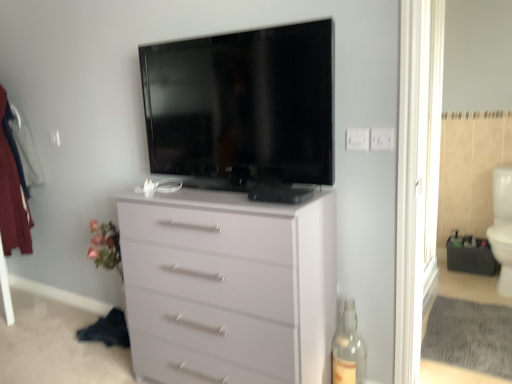
Question: From a real-world perspective, is transparent glass door at right physically below white glossy toilet bowl at right?

Choices:
 (A) yes
 (B) no

Answer: (B)

Question: Can you confirm if transparent glass door at right is wider than white glossy toilet bowl at right?

Choices:
 (A) no
 (B) yes

Answer: (A)

Question: Can you confirm if transparent glass door at right is smaller than white glossy toilet bowl at right?

Choices:
 (A) no
 (B) yes

Answer: (A)

Question: Can you confirm if transparent glass door at right is shorter than white glossy toilet bowl at right?

Choices:
 (A) yes
 (B) no

Answer: (B)

Question: Is transparent glass door at right completely or partially outside of white glossy toilet bowl at right?

Choices:
 (A) no
 (B) yes

Answer: (B)

Question: From a real-world perspective, is transparent glass bottle at lower right above or below white plastic electric outlet at upper right, which ranks as the second electric outlet in right-to-left order?

Choices:
 (A) below
 (B) above

Answer: (A)

Question: Considering the positions of point (343, 316) and point (357, 147), is point (343, 316) closer or farther from the camera than point (357, 147)?

Choices:
 (A) farther
 (B) closer

Answer: (A)

Question: Is transparent glass bottle at lower right taller or shorter than white plastic electric outlet at upper right, which appears as the first electric outlet when viewed from the left?

Choices:
 (A) short
 (B) tall

Answer: (B)

Question: Based on their positions, is transparent glass bottle at lower right located to the left or right of white plastic electric outlet at upper right, which appears as the first electric outlet when viewed from the left?

Choices:
 (A) right
 (B) left

Answer: (B)

Question: Is point [x=349, y=337] closer or farther from the camera than point [x=424, y=254]?

Choices:
 (A) farther
 (B) closer

Answer: (B)

Question: From the image's perspective, relative to transparent glass door at right, is transparent glass bottle at lower right above or below?

Choices:
 (A) below
 (B) above

Answer: (A)

Question: Is transparent glass bottle at lower right bigger or smaller than transparent glass door at right?

Choices:
 (A) small
 (B) big

Answer: (A)

Question: Relative to transparent glass door at right, is transparent glass bottle at lower right in front or behind?

Choices:
 (A) front
 (B) behind

Answer: (A)

Question: Would you say flat screen tv at upper center is inside or outside transparent glass door at right?

Choices:
 (A) outside
 (B) inside

Answer: (A)

Question: Does point (169, 87) appear closer or farther from the camera than point (431, 82)?

Choices:
 (A) farther
 (B) closer

Answer: (B)